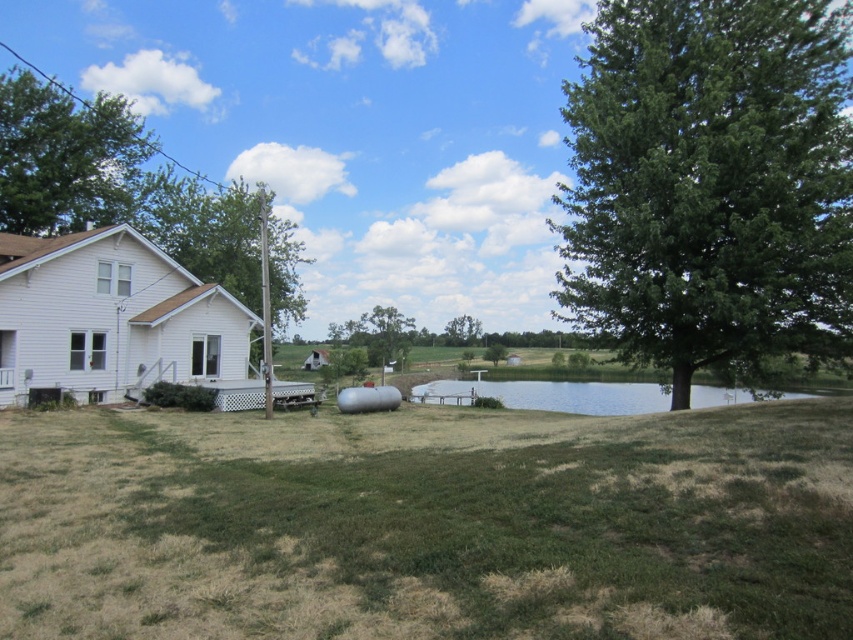
Can you confirm if green leafy tree at upper left is positioned to the right of green leafy tree at center?

Incorrect, green leafy tree at upper left is not on the right side of green leafy tree at center.

Is green leafy tree at upper left bigger than green leafy tree at center?

Indeed, green leafy tree at upper left has a larger size compared to green leafy tree at center.

Does point (53, 200) come in front of point (466, 316)?

Yes, point (53, 200) is in front of point (466, 316).

Locate an element on the screen. The height and width of the screenshot is (640, 853). green leafy tree at upper left is located at coordinates (64, 157).

In the scene shown: Does clear water at center have a lesser width compared to green leafy tree at center?

No, clear water at center is not thinner than green leafy tree at center.

Is point (416, 396) less distant than point (453, 323)?

Yes.

In the scene shown: Who is more distant from viewer, (538, 381) or (480, 330)?

The point (480, 330) is behind.

The height and width of the screenshot is (640, 853). I want to click on clear water at center, so click(549, 396).

Is green leafy tree at right wider than green leafy tree at center?

Indeed, green leafy tree at right has a greater width compared to green leafy tree at center.

How far apart are green leafy tree at right and green leafy tree at center?

green leafy tree at right and green leafy tree at center are 73.66 meters apart from each other.

The image size is (853, 640). Find the location of `green leafy tree at right`. green leafy tree at right is located at coordinates (711, 182).